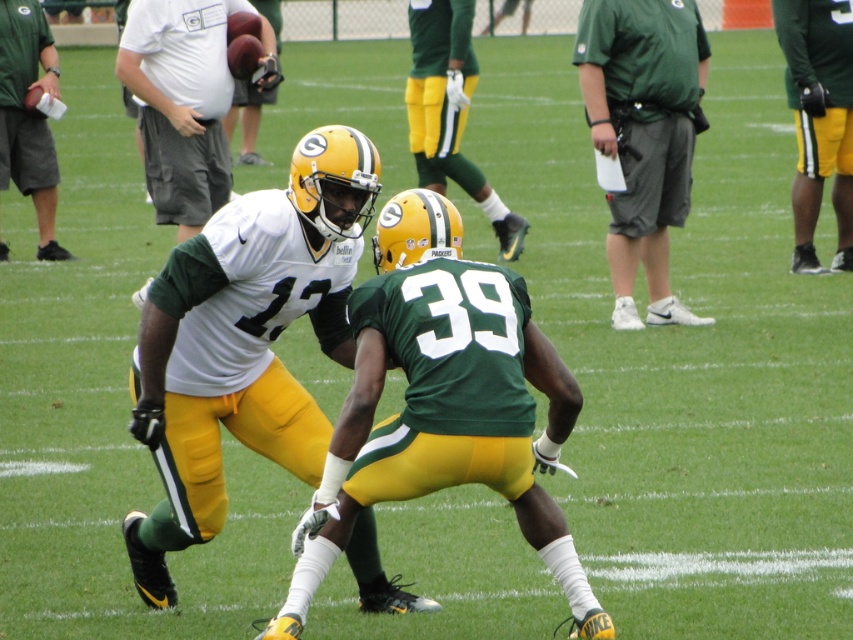
You are a photographer standing at the edge of the field. You want to take a photo that focuses on the matte white jersey at center and the green fabric shirt at upper center. Which one will appear larger in your photo?

The matte white jersey at center will appear larger in the photo because it is closer to the viewer than the green fabric shirt at upper center.

You are a photographer positioned at the origin of the coordinate system. You need to capture a photo of the matte white jersey at center located at point (244,340). What direction should you move your camera to frame the jersey properly?

The matte white jersey at center is located at point (244,340), so you should move your camera towards that coordinate to frame it properly.